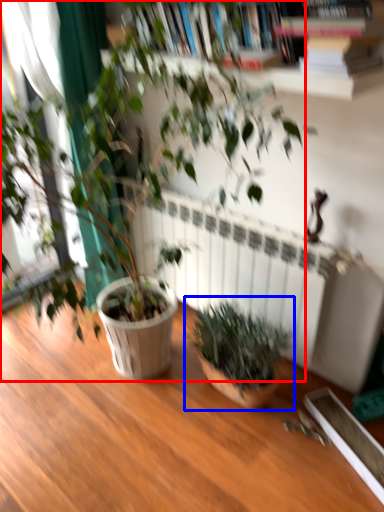
Question: Among these objects, which one is farthest to the camera, houseplant (highlighted by a red box) or houseplant (highlighted by a blue box)?

Choices:
 (A) houseplant
 (B) houseplant

Answer: (B)